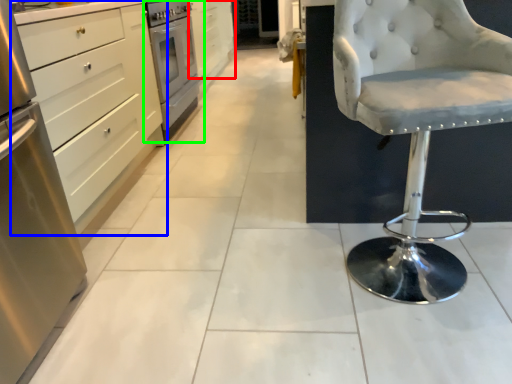
Question: Based on their relative distances, which object is farther from cabinetry (highlighted by a red box)? Choose from cabinetry (highlighted by a blue box) and home appliance (highlighted by a green box).

Choices:
 (A) cabinetry
 (B) home appliance

Answer: (A)